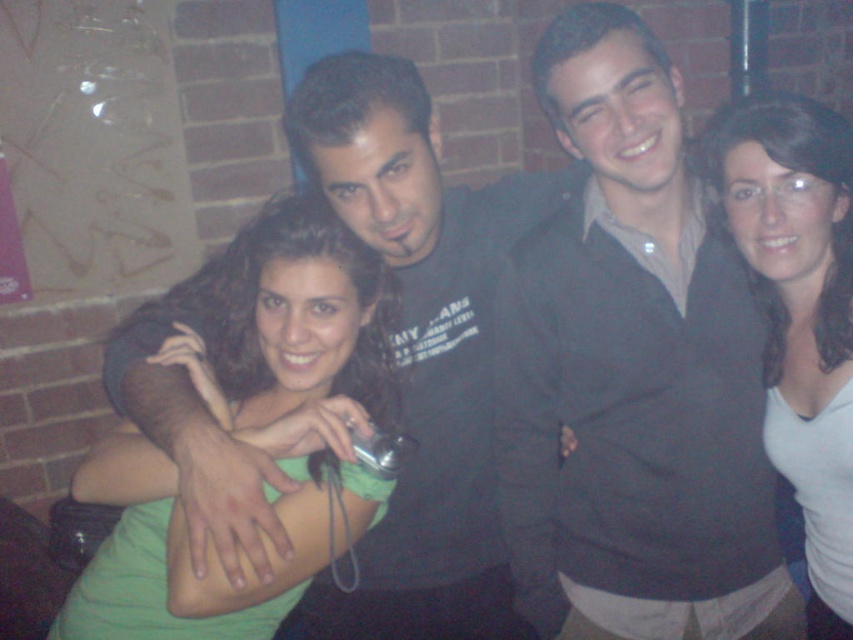
Does dark gray sweater at center appear over green matte shirt at center?

Indeed, dark gray sweater at center is positioned over green matte shirt at center.

Which is below, dark gray sweater at center or green matte shirt at center?

green matte shirt at center

Who is more distant from viewer, (619,408) or (309,324)?

The point (619,408) is behind.

At what (x,y) coordinates should I click in order to perform the action: click on dark gray sweater at center. Please return your answer as a coordinate pair (x, y). This screenshot has width=853, height=640. Looking at the image, I should click on (633, 374).

Looking at this image, is green matte shirt at center to the right of white matte shirt at right from the viewer's perspective?

No, green matte shirt at center is not to the right of white matte shirt at right.

Is green matte shirt at center thinner than white matte shirt at right?

No, green matte shirt at center is not thinner than white matte shirt at right.

Based on the photo, who is more distant from viewer, (x=387, y=360) or (x=815, y=564)?

The point (x=815, y=564) is behind.

At what (x,y) coordinates should I click in order to perform the action: click on green matte shirt at center. Please return your answer as a coordinate pair (x, y). This screenshot has width=853, height=640. Looking at the image, I should click on (253, 433).

Does matte black hoodie at center come behind white matte shirt at right?

No, it is in front of white matte shirt at right.

Is point (503, 636) closer to viewer compared to point (833, 374)?

No, it is not.

Identify the location of matte black hoodie at center. (421, 349).